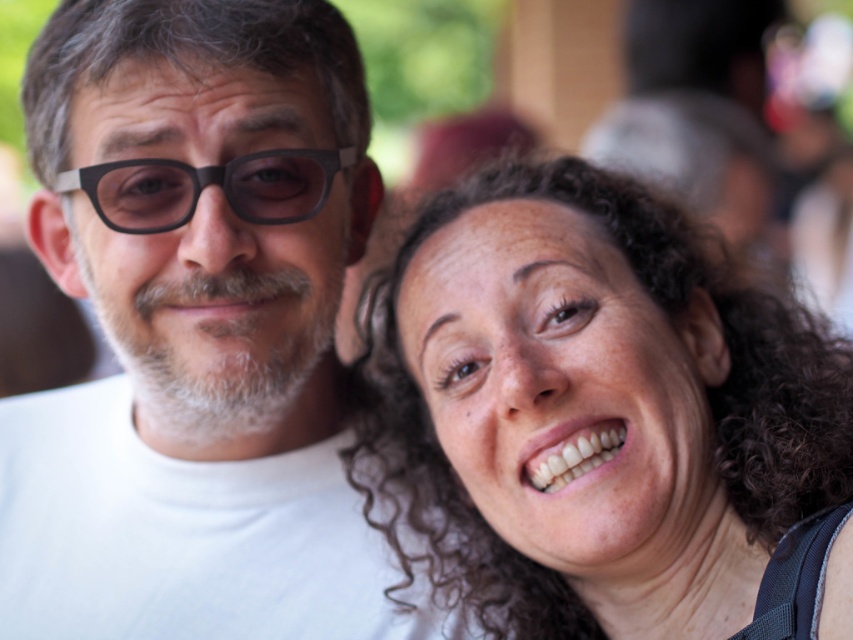
Question: Is white matte t-shirt at left further to the viewer compared to curly hair at upper right?

Choices:
 (A) no
 (B) yes

Answer: (B)

Question: Which point appears closest to the camera in this image?

Choices:
 (A) (534, 556)
 (B) (142, 275)

Answer: (A)

Question: Is curly hair at upper right further to the viewer compared to black plastic glasses at upper left?

Choices:
 (A) no
 (B) yes

Answer: (A)

Question: Which object is positioned farthest from the curly hair at upper right?

Choices:
 (A) white matte t-shirt at left
 (B) black plastic glasses at upper left

Answer: (B)

Question: Which point is closer to the camera taking this photo?

Choices:
 (A) (231, 150)
 (B) (453, 470)
 (C) (172, 188)

Answer: (A)

Question: From the image, what is the correct spatial relationship of white matte t-shirt at left in relation to black plastic glasses at upper left?

Choices:
 (A) below
 (B) above

Answer: (A)